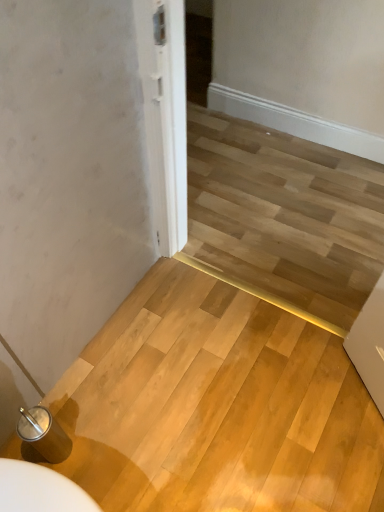
Find the location of `vacant region above wooden stairwell at lower left (from a real-world perspective)`. vacant region above wooden stairwell at lower left (from a real-world perspective) is located at coordinates (220, 408).